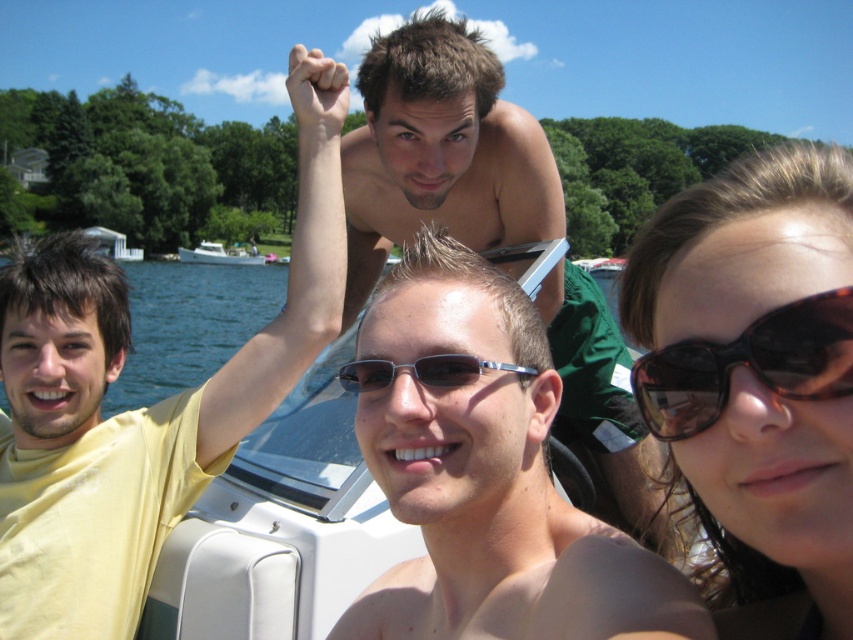
Between point (625, 396) and point (352, 372), which one is positioned behind?

The point (625, 396) is more distant.

Can you confirm if shiny brown hair at upper center is wider than sunglasses at center?

Correct, the width of shiny brown hair at upper center exceeds that of sunglasses at center.

Does point (584, 284) come behind point (341, 368)?

That is True.

Locate an element on the screen. The height and width of the screenshot is (640, 853). shiny brown hair at upper center is located at coordinates (440, 152).

The width and height of the screenshot is (853, 640). I want to click on yellow t-shirt at upper left, so click(x=140, y=408).

Is point (303, 99) farther from viewer compared to point (408, 230)?

No, (303, 99) is closer to viewer.

The image size is (853, 640). What are the coordinates of `yellow t-shirt at upper left` in the screenshot? It's located at click(140, 408).

Identify the location of yellow t-shirt at upper left. This screenshot has width=853, height=640. (140, 408).

Does yellow t-shirt at upper left have a greater width compared to sunglasses at center?

No.

Where is `yellow t-shirt at upper left`? yellow t-shirt at upper left is located at coordinates (140, 408).